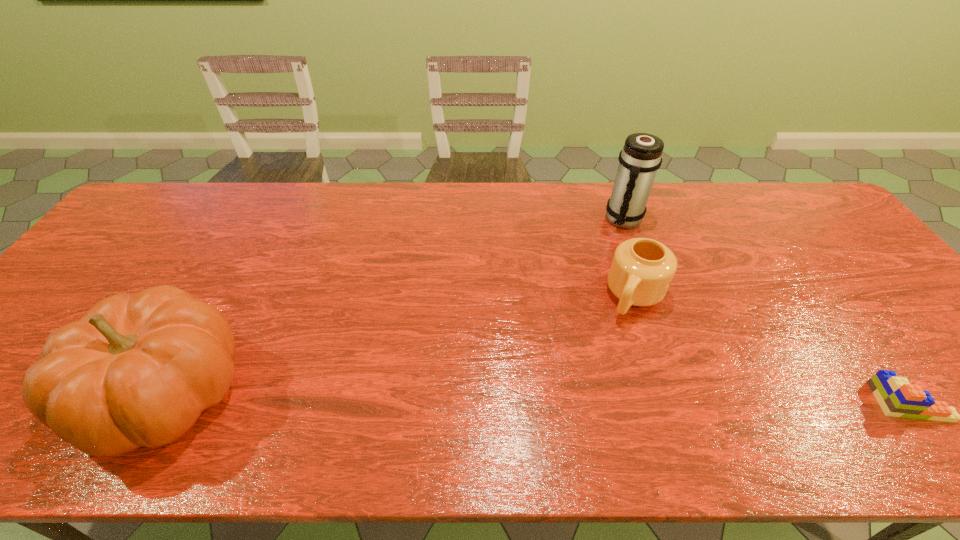
Find the location of a particular element. vacant space located 0.060m on the handle side of the second shortest object is located at coordinates (618, 335).

You are a GUI agent. You are given a task and a screenshot of the screen. Output one action in this format:
    pyautogui.click(x=<x>, y=<y>)
    Task: Click on the vacant space located 0.090m on the side with the handle of the farthest object
    
    Given the screenshot: What is the action you would take?
    (623, 253)

Image resolution: width=960 pixels, height=540 pixels. I want to click on free space located 0.110m on the side with the handle of the farthest object, so click(x=623, y=258).

You are a GUI agent. You are given a task and a screenshot of the screen. Output one action in this format:
    pyautogui.click(x=<x>, y=<y>)
    Task: Click on the vacant space located on the side with the handle of the farthest object
    The image size is (960, 540).
    Given the screenshot: What is the action you would take?
    pyautogui.click(x=622, y=285)

The height and width of the screenshot is (540, 960). I want to click on object that is at the far edge, so click(641, 156).

Find the location of a particular element. The image size is (960, 540). pumpkin located in the near edge section of the desktop is located at coordinates tap(137, 370).

Identify the location of Lego present at the near edge. (896, 396).

Where is `object at the right edge`? Image resolution: width=960 pixels, height=540 pixels. object at the right edge is located at coordinates (896, 396).

The height and width of the screenshot is (540, 960). Identify the location of object that is at the near right corner. (896, 396).

Find the location of `blank space at the far edge of the desktop`. blank space at the far edge of the desktop is located at coordinates (550, 191).